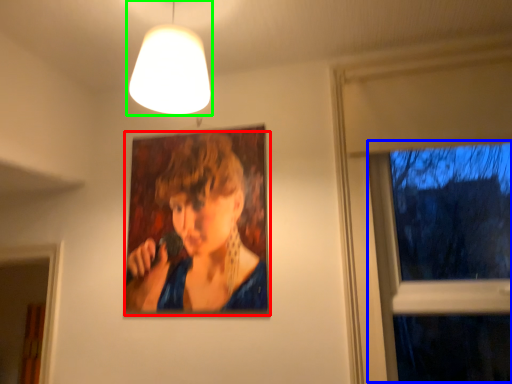
Question: Which object is the farthest from person (highlighted by a red box)? Choose among these: window (highlighted by a blue box) or lamp (highlighted by a green box).

Choices:
 (A) window
 (B) lamp

Answer: (A)